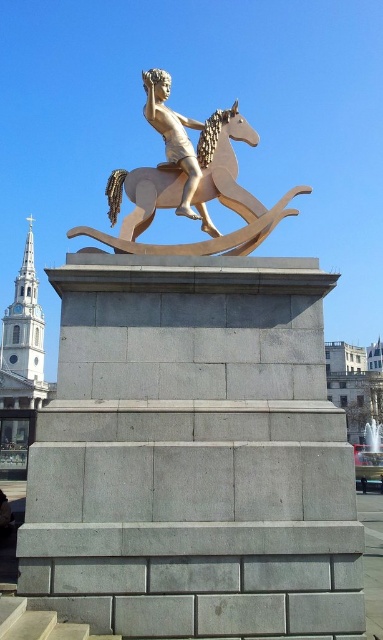
Looking at this image, is gold polished horse at center thinner than gold polished statue at center?

No, gold polished horse at center is not thinner than gold polished statue at center.

Which of these two, gold polished horse at center or gold polished statue at center, stands taller?

With more height is gold polished statue at center.

This screenshot has width=383, height=640. Find the location of `gold polished horse at center`. gold polished horse at center is located at coordinates (224, 164).

At what (x,y) coordinates should I click in order to perform the action: click on gold polished horse at center. Please return your answer as a coordinate pair (x, y). This screenshot has height=640, width=383. Looking at the image, I should click on (224, 164).